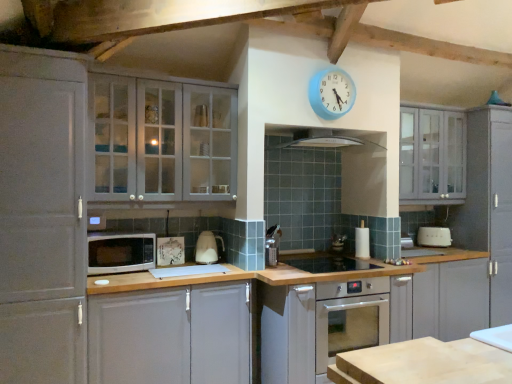
Question: Is white matte cabinet at lower left, placed as the second cabinetry when sorted from right to left, thinner than matte gray cabinet at upper left, which ranks as the 3th cabinetry in right-to-left order?

Choices:
 (A) no
 (B) yes

Answer: (A)

Question: Is white matte cabinet at lower left, placed as the second cabinetry when sorted from right to left, shorter than matte gray cabinet at upper left, which ranks as the 3th cabinetry in right-to-left order?

Choices:
 (A) no
 (B) yes

Answer: (A)

Question: Is white matte cabinet at lower left, placed as the second cabinetry when sorted from right to left, positioned with its back to matte gray cabinet at upper left, which ranks as the 3th cabinetry in right-to-left order?

Choices:
 (A) no
 (B) yes

Answer: (A)

Question: Considering the relative sizes of white matte cabinet at lower left, placed as the second cabinetry when sorted from right to left, and matte gray cabinet at upper left, acting as the second cabinetry starting from the left, in the image provided, is white matte cabinet at lower left, placed as the second cabinetry when sorted from right to left, taller than matte gray cabinet at upper left, acting as the second cabinetry starting from the left,?

Choices:
 (A) no
 (B) yes

Answer: (B)

Question: From the image's perspective, would you say white matte cabinet at lower left, the 3th cabinetry viewed from the left, is positioned over matte gray cabinet at upper left, which ranks as the 3th cabinetry in right-to-left order?

Choices:
 (A) yes
 (B) no

Answer: (B)

Question: From their relative heights in the image, would you say wooden cutting board at lower right is taller or shorter than metallic silver toaster at center, the 3th appliance from the left?

Choices:
 (A) short
 (B) tall

Answer: (A)

Question: Based on their positions, is wooden cutting board at lower right located to the left or right of metallic silver toaster at center, the 2th appliance viewed from the right?

Choices:
 (A) left
 (B) right

Answer: (A)

Question: Considering the positions of wooden cutting board at lower right and metallic silver toaster at center, the 2th appliance viewed from the right, in the image, is wooden cutting board at lower right bigger or smaller than metallic silver toaster at center, the 2th appliance viewed from the right,?

Choices:
 (A) big
 (B) small

Answer: (A)

Question: From the image's perspective, relative to metallic silver toaster at center, which is the 3th appliance from front to back, is wooden cutting board at lower right above or below?

Choices:
 (A) below
 (B) above

Answer: (A)

Question: Relative to white matte microwave at lower left, is satin silver exhaust hood at center in front or behind?

Choices:
 (A) behind
 (B) front

Answer: (A)

Question: Is point (352, 140) closer or farther from the camera than point (120, 236)?

Choices:
 (A) closer
 (B) farther

Answer: (B)

Question: From a real-world perspective, is satin silver exhaust hood at center positioned above or below white matte microwave at lower left?

Choices:
 (A) below
 (B) above

Answer: (B)

Question: Is satin silver exhaust hood at center taller or shorter than white matte microwave at lower left?

Choices:
 (A) short
 (B) tall

Answer: (A)

Question: Visually, is white glossy electric kettle at center, which is the 3th appliance from back to front, positioned to the left or to the right of shiny stainless steel sink at center, positioned as the third appliance in right-to-left order?

Choices:
 (A) right
 (B) left

Answer: (B)

Question: From a real-world perspective, is white glossy electric kettle at center, the 1th appliance in the left-to-right sequence, positioned above or below shiny stainless steel sink at center, positioned as the third appliance in right-to-left order?

Choices:
 (A) below
 (B) above

Answer: (B)